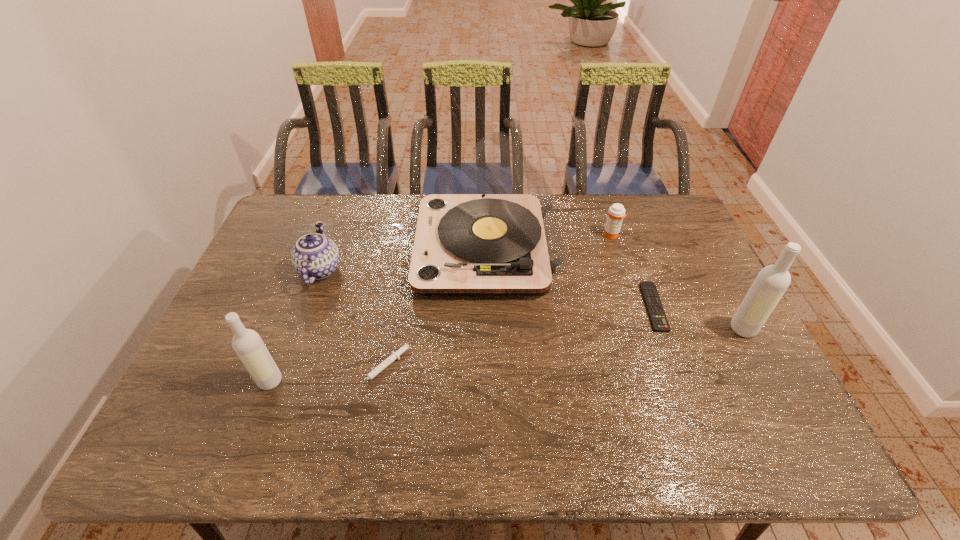
The image size is (960, 540). Identify the location of vacant space located on the front of the rightmost object. (775, 388).

The width and height of the screenshot is (960, 540). I want to click on free space located 0.110m with the tonearm facing the front of the record player, so click(x=383, y=248).

The width and height of the screenshot is (960, 540). I want to click on vacant space located with the tonearm facing the front of the record player, so click(331, 248).

Where is `vacant space situated 0.070m with the tonearm facing the front of the record player`? vacant space situated 0.070m with the tonearm facing the front of the record player is located at coordinates (396, 248).

Locate an element on the screen. free point located 0.050m on the right of the fifth tallest object is located at coordinates (635, 235).

In order to click on vacant space located at the spout of the fourth tallest object in this screenshot , I will do `click(359, 270)`.

Where is `free space located on the back of the remote control`? This screenshot has width=960, height=540. free space located on the back of the remote control is located at coordinates (618, 212).

The image size is (960, 540). What are the coordinates of `vacant region located 0.260m on the left of the second shortest object` in the screenshot? It's located at (257, 368).

Find the location of `record player that is at the far edge`. record player that is at the far edge is located at coordinates (505, 241).

You are a GUI agent. You are given a task and a screenshot of the screen. Output one action in this format:
    pyautogui.click(x=<x>, y=<y>)
    Task: Click on the medicine at the far edge
    This screenshot has height=540, width=960.
    Given the screenshot: What is the action you would take?
    pyautogui.click(x=616, y=213)